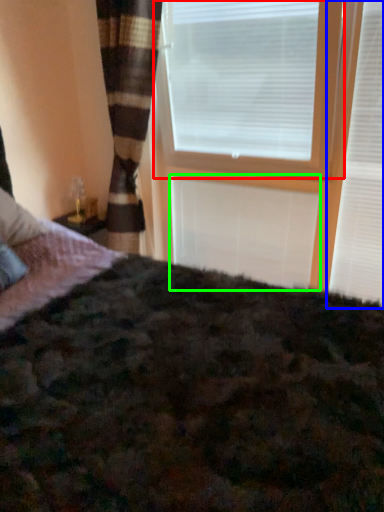
Question: Based on their relative distances, which object is nearer to window blind (highlighted by a red box)? Choose from window blind (highlighted by a blue box) and blind (highlighted by a green box).

Choices:
 (A) window blind
 (B) blind

Answer: (B)